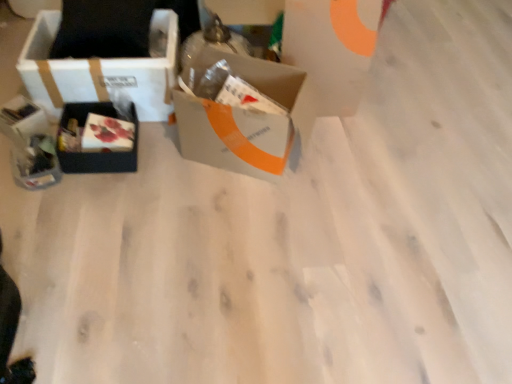
I want to click on blank space to the left of matte black gift box at left, which ranks as the first gift box in bottom-to-top order, so click(x=10, y=163).